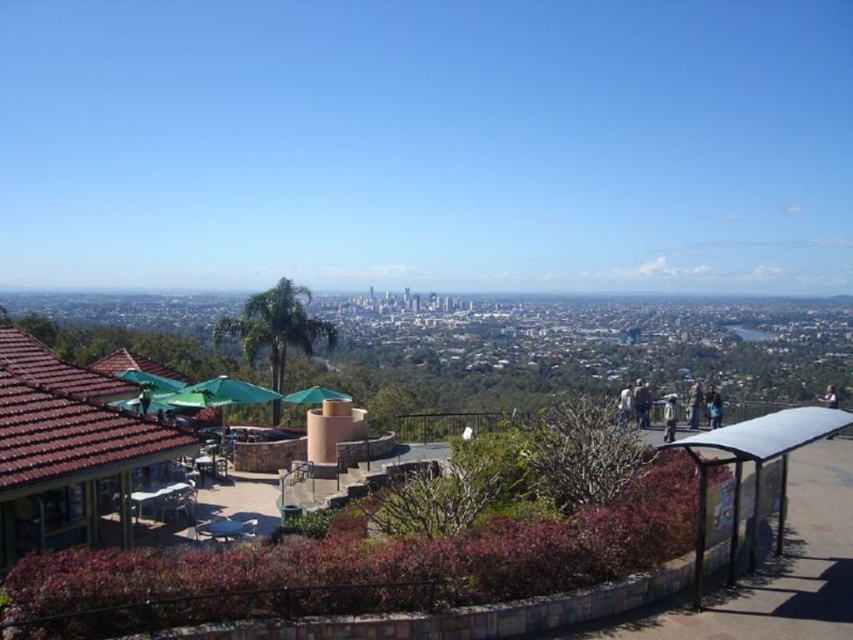
You are a tourist standing at the overlook and want to take a photo of the cityscape. You notice the metallic silver bus stop at lower right and the dark blue shirt at center right in your frame. Which object should you adjust your camera angle to avoid blocking the city view?

You should adjust your camera angle to avoid the metallic silver bus stop at lower right because it is shorter than the dark blue shirt at center right and might block the view if not positioned carefully.

You are a photographer planning to capture a photo of the dark blue shirt at center right and the dark blue fabric at lower right. Which object should you focus on first if you want to include both in the frame without moving the camera?

The dark blue shirt at center right has a lesser height compared to dark blue fabric at lower right, so you should focus on the dark blue fabric at lower right first since it is taller and will occupy more space in the frame.